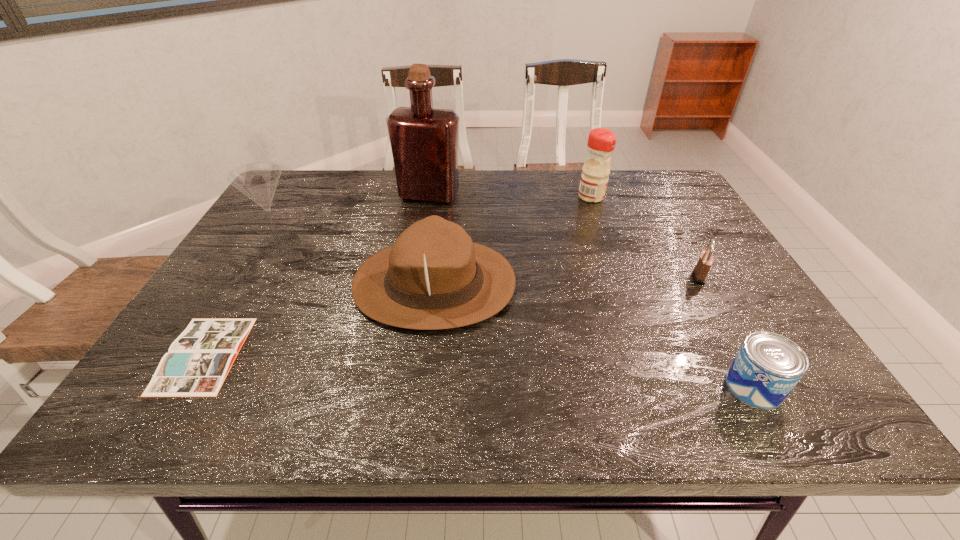
Locate an element on the screen. Image resolution: width=960 pixels, height=540 pixels. liquor is located at coordinates (424, 141).

I want to click on the fifth object from left to right, so click(x=595, y=173).

The width and height of the screenshot is (960, 540). Find the location of `flute glass`. flute glass is located at coordinates (258, 181).

Identify the location of fedora. The height and width of the screenshot is (540, 960). (434, 277).

Locate an element on the screen. This screenshot has height=540, width=960. padlock is located at coordinates (700, 272).

The image size is (960, 540). Identify the location of can. (767, 367).

Find the location of a particular element. book is located at coordinates (199, 360).

This screenshot has width=960, height=540. I want to click on vacant space located 0.400m on the front of the liquor, so click(x=412, y=299).

The width and height of the screenshot is (960, 540). Identify the location of blank area located 0.120m on the back of the third object from right to left. (582, 172).

This screenshot has width=960, height=540. Find the location of `vacant area situated on the right of the flute glass`. vacant area situated on the right of the flute glass is located at coordinates (421, 244).